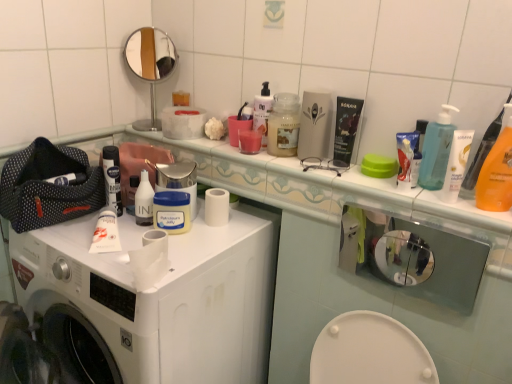
Find the location of a particular element. Image resolution: width=512 pixels, height=384 pixels. free space in front of translucent plastic jar at center, the first mouthwash from the right is located at coordinates (297, 166).